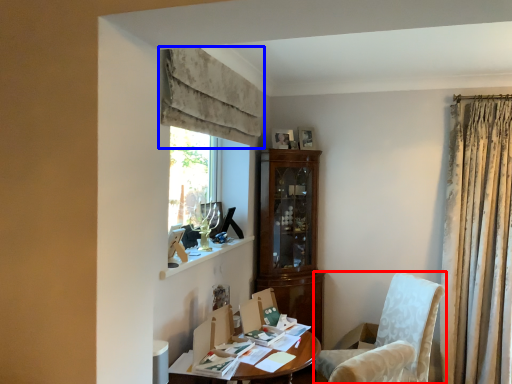
Question: Which of the following is the closest to the observer, chair (highlighted by a red box) or curtain (highlighted by a blue box)?

Choices:
 (A) chair
 (B) curtain

Answer: (B)